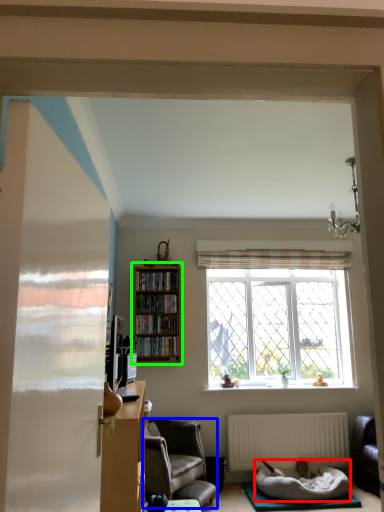
Question: Considering the real-world distances, which object is closest to bedding (highlighted by a red box)? chair (highlighted by a blue box) or bookcase (highlighted by a green box).

Choices:
 (A) chair
 (B) bookcase

Answer: (A)